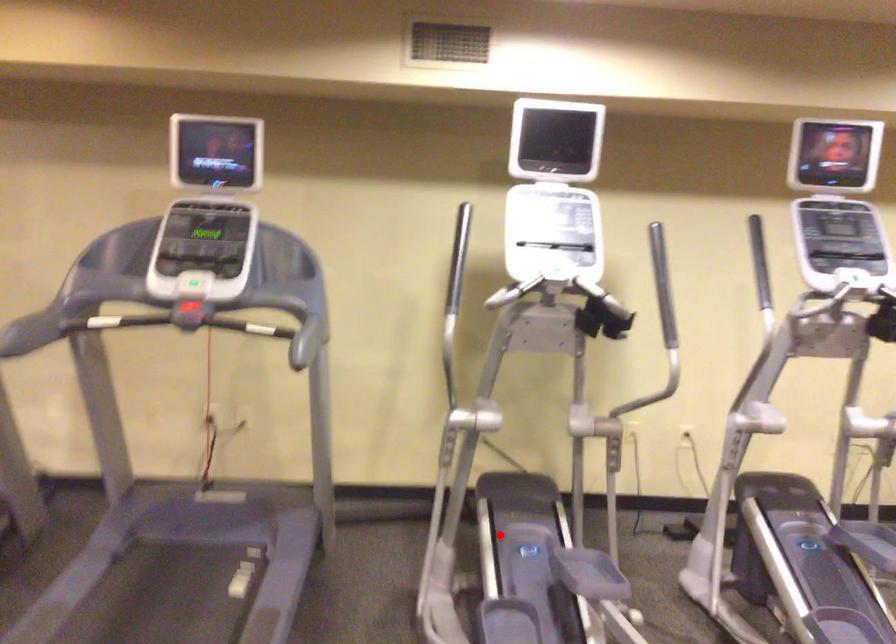
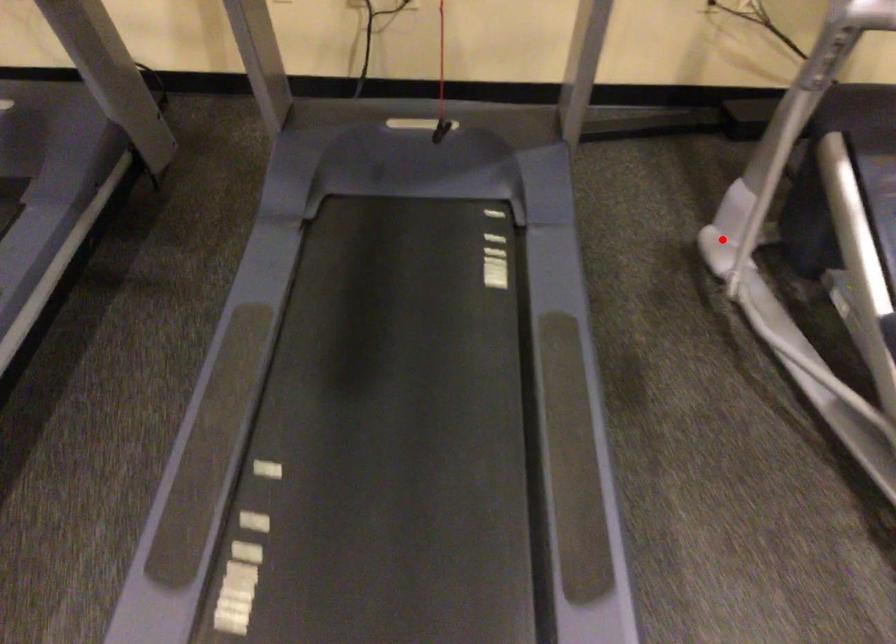
I am providing you with two images of the same scene from different viewpoints. A red point is marked on the first image and another point is marked on the second image. Do the highlighted points in image1 and image2 indicate the same real-world spot?

No